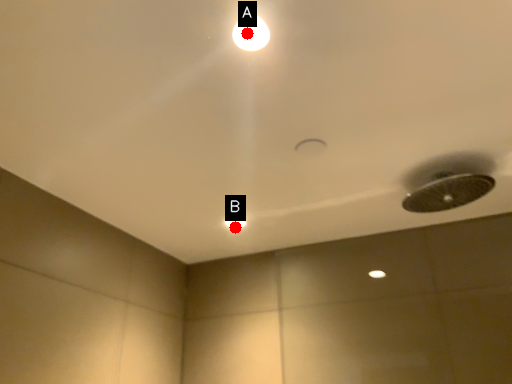
Question: Two points are circled on the image, labeled by A and B beside each circle. Which point is closer to the camera taking this photo?

Choices:
 (A) A is closer
 (B) B is closer

Answer: (A)